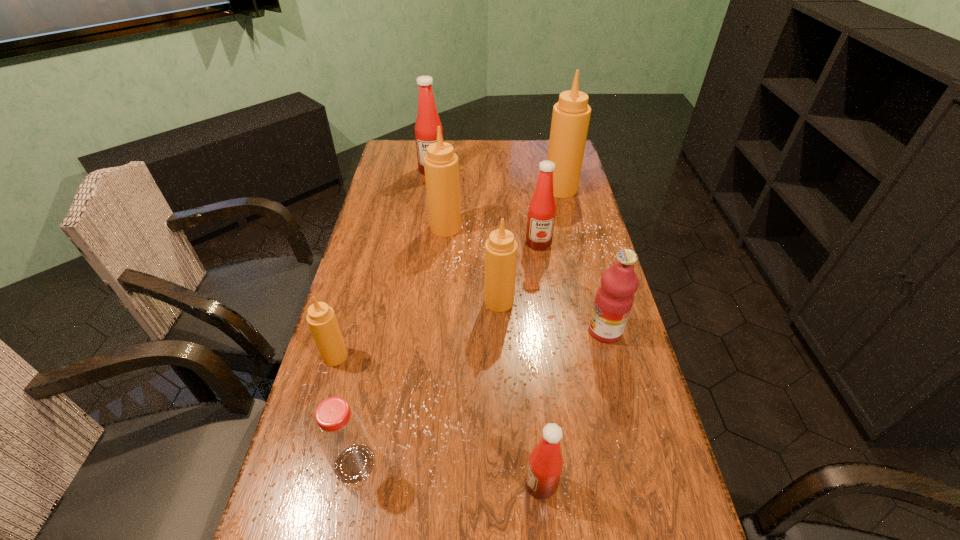
Locate an element on the screen. This screenshot has height=540, width=960. the farthest tan condiment is located at coordinates (571, 114).

Locate an element on the screen. Image resolution: width=960 pixels, height=540 pixels. the tallest object is located at coordinates pos(571,114).

This screenshot has height=540, width=960. In order to click on the farthest red condiment in this screenshot , I will do `click(427, 122)`.

Identify the location of the leftmost red condiment. (427, 122).

Locate an element on the screen. the third tan condiment from right to left is located at coordinates point(441,166).

What are the coordinates of `the third nearest tan condiment` in the screenshot? It's located at pos(441,166).

Find the location of `the fifth farthest object`. the fifth farthest object is located at coordinates (501, 248).

Where is `the third biggest tan condiment`? The height and width of the screenshot is (540, 960). the third biggest tan condiment is located at coordinates (501, 248).

In order to click on the second biggest red condiment in this screenshot , I will do `click(541, 214)`.

Find the location of a particular element. pink fruit juice is located at coordinates (614, 299).